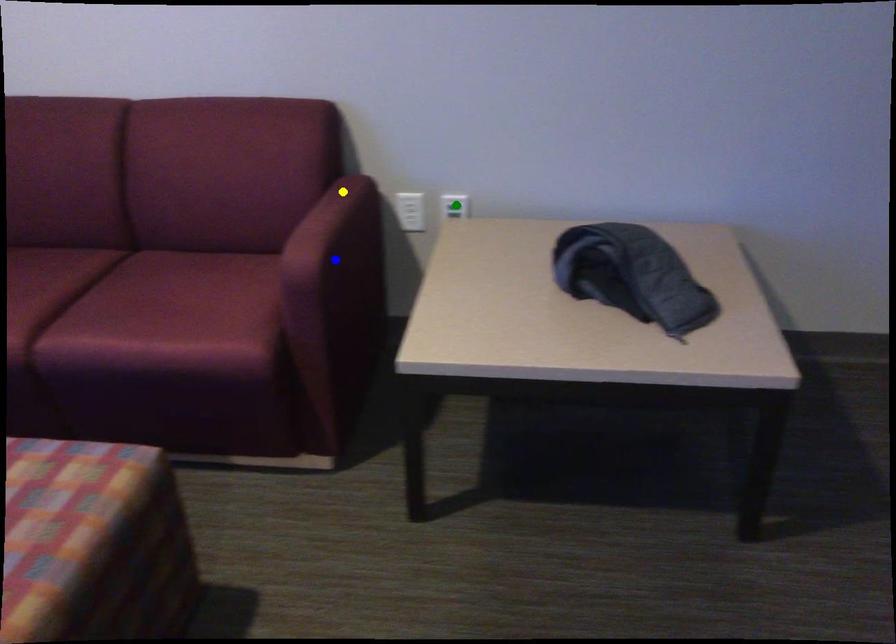
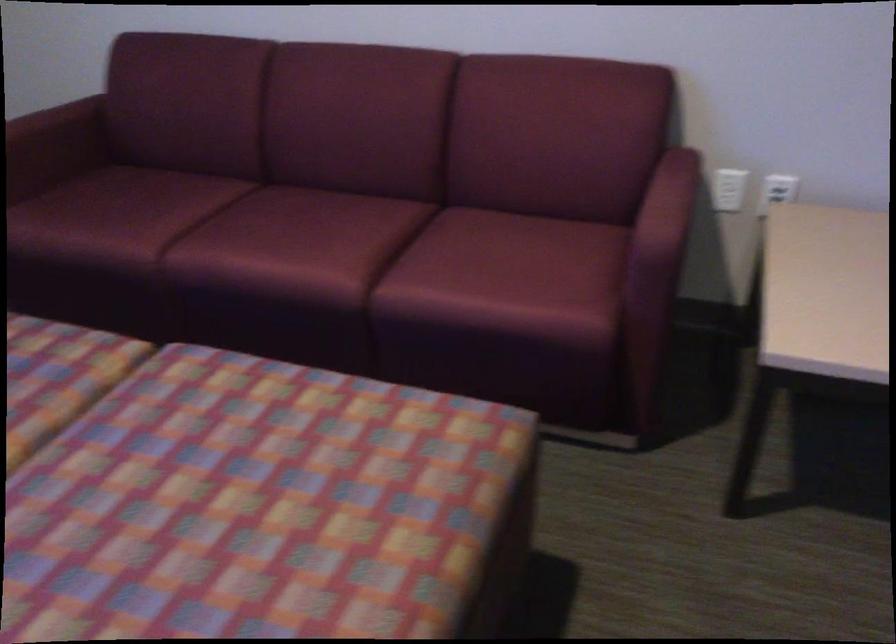
I am providing you with two images of the same scene from different viewpoints. Three points are marked in image1. Which point corresponds to a part or object that is occluded in image2?In image1, three points are marked. Which of them correspond to a part or object that is occluded in image2?Among the three points shown in image1, which one corresponds to a part or object that is no longer visible due to occlusion in image2?

Invisible in image2: blue point.